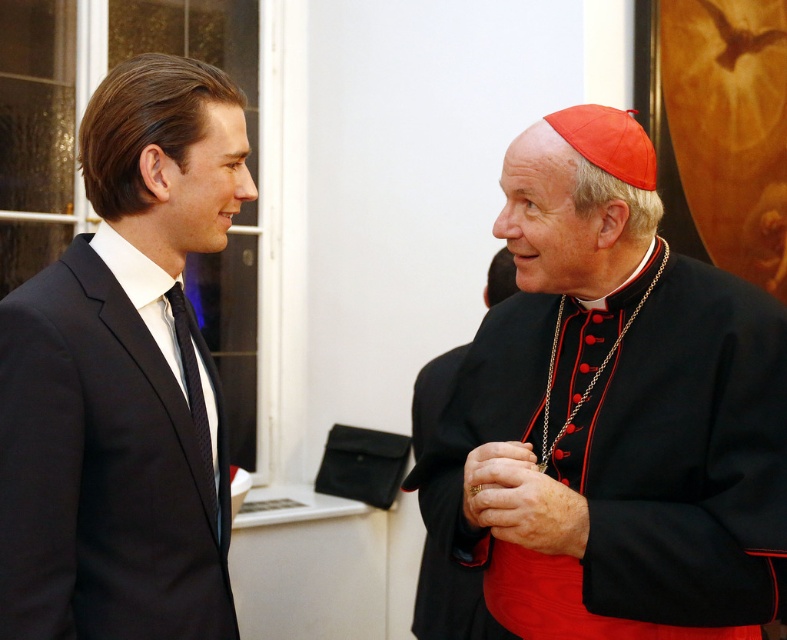
Question: Which of the following is the closest to the observer?

Choices:
 (A) matte black suit at left
 (B) black satin cassock at center
 (C) black satin robe at right

Answer: (B)

Question: Does matte black suit at left appear under black satin robe at right?

Choices:
 (A) yes
 (B) no

Answer: (B)

Question: Does black satin cassock at center have a greater width compared to black satin robe at right?

Choices:
 (A) yes
 (B) no

Answer: (A)

Question: Is black satin cassock at center smaller than black satin robe at right?

Choices:
 (A) yes
 (B) no

Answer: (B)

Question: Estimate the real-world distances between objects in this image. Which object is farther from the black satin robe at right?

Choices:
 (A) black satin cassock at center
 (B) matte black suit at left

Answer: (B)

Question: Which object is farther from the camera taking this photo?

Choices:
 (A) black satin cassock at center
 (B) matte black suit at left
 (C) black satin robe at right

Answer: (C)